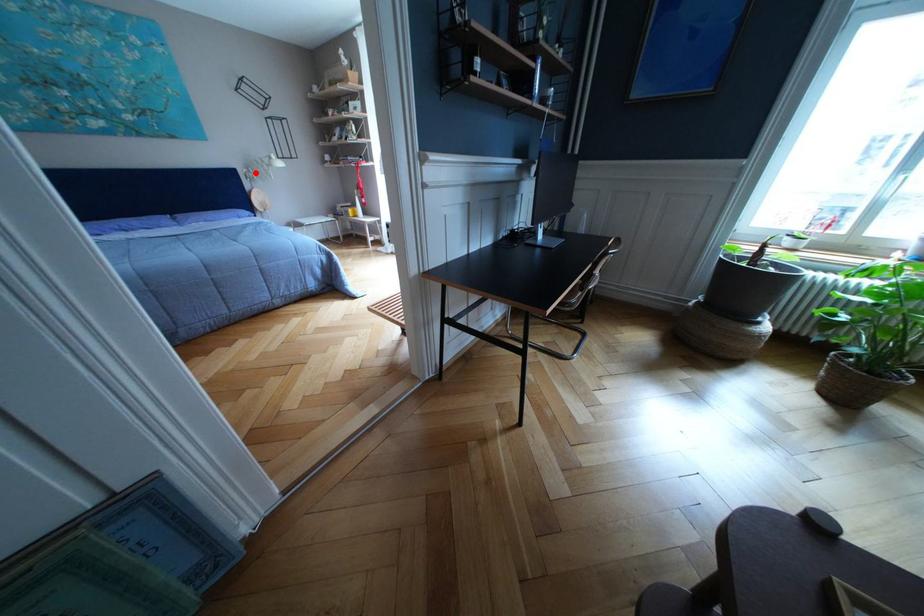
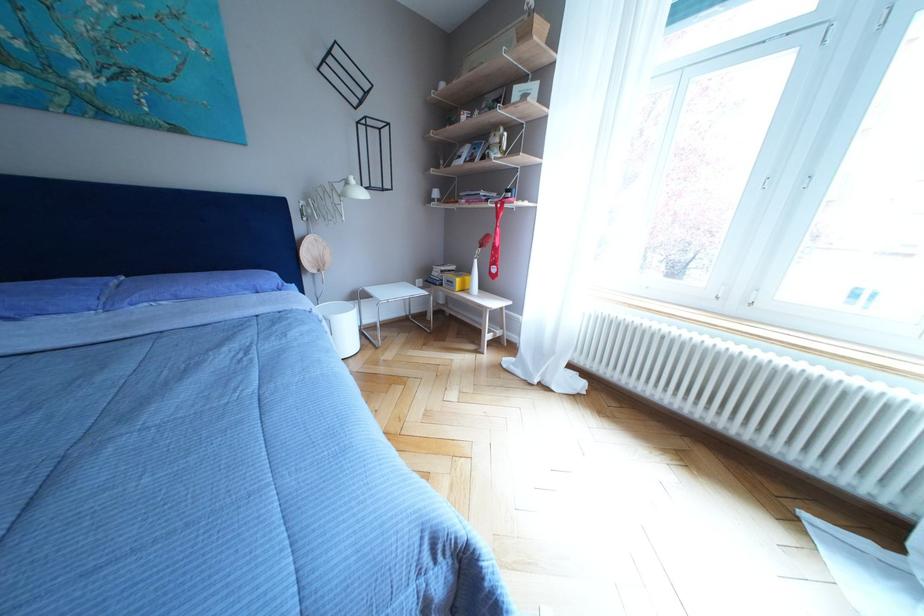
Where in the second image is the point corresponding to the highlighted location from the first image?

(315, 203)